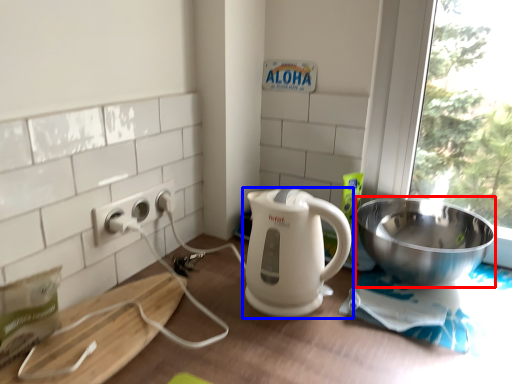
Question: Which object appears farthest to the camera in this image, bowl (highlighted by a red box) or kitchen appliance (highlighted by a blue box)?

Choices:
 (A) bowl
 (B) kitchen appliance

Answer: (A)